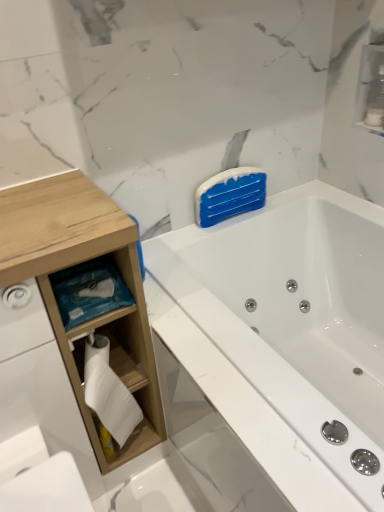
Question: Considering the positions of white wood toilet paper holder at left, arranged as the first cabinet when viewed from the left, and wooden cabinet at left in the image, is white wood toilet paper holder at left, arranged as the first cabinet when viewed from the left, bigger or smaller than wooden cabinet at left?

Choices:
 (A) big
 (B) small

Answer: (B)

Question: From a real-world perspective, relative to wooden cabinet at left, is white wood toilet paper holder at left, the 1th cabinet in the bottom-to-top sequence, vertically above or below?

Choices:
 (A) above
 (B) below

Answer: (B)

Question: Which object is the closest to the white glossy bathtub at upper right?

Choices:
 (A) white wood toilet paper holder at left, the 2th cabinet from the right
 (B) white glossy cabinet at upper right, which is the second cabinet in left-to-right order
 (C) wooden cabinet at left

Answer: (C)

Question: Estimate the real-world distances between objects in this image. Which object is closer to the white glossy bathtub at upper right?

Choices:
 (A) white wood toilet paper holder at left, the 1th cabinet in the bottom-to-top sequence
 (B) wooden cabinet at left
 (C) white glossy cabinet at upper right, which is the 2th cabinet from bottom to top

Answer: (B)